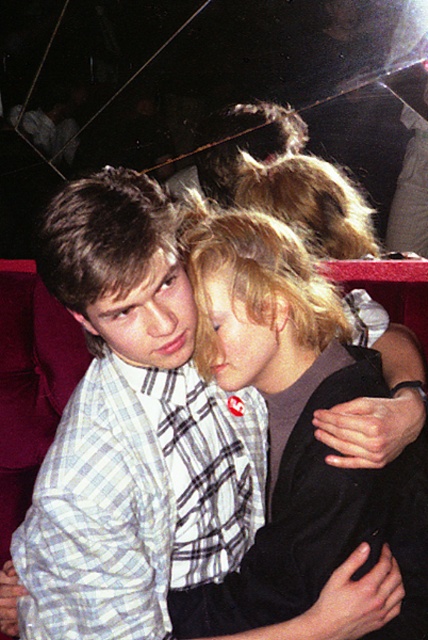
Question: Which point is closer to the camera?

Choices:
 (A) (276, 576)
 (B) (128, 416)

Answer: (A)

Question: Does white checkered shirt at center have a smaller size compared to blonde hair at center?

Choices:
 (A) no
 (B) yes

Answer: (B)

Question: Which object is closer to the camera taking this photo?

Choices:
 (A) blonde hair at center
 (B) white checkered shirt at center

Answer: (B)

Question: Observing the image, what is the correct spatial positioning of white checkered shirt at center in reference to blonde hair at center?

Choices:
 (A) right
 (B) left

Answer: (B)

Question: Can you confirm if white checkered shirt at center is positioned below blonde hair at center?

Choices:
 (A) yes
 (B) no

Answer: (A)

Question: Which of the following is the closest to the observer?

Choices:
 (A) white checkered shirt at center
 (B) blonde hair at center

Answer: (A)